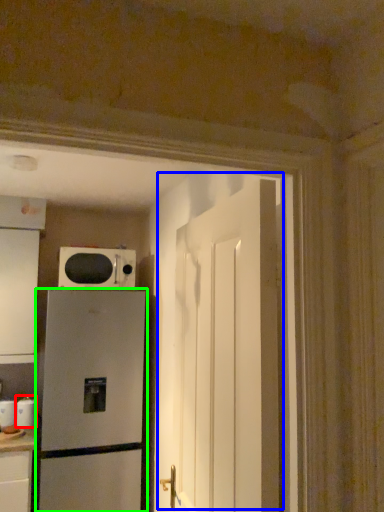
Question: Based on their relative distances, which object is nearer to appliance (highlighted by a red box)? Choose from door (highlighted by a blue box) and refrigerator (highlighted by a green box).

Choices:
 (A) door
 (B) refrigerator

Answer: (B)